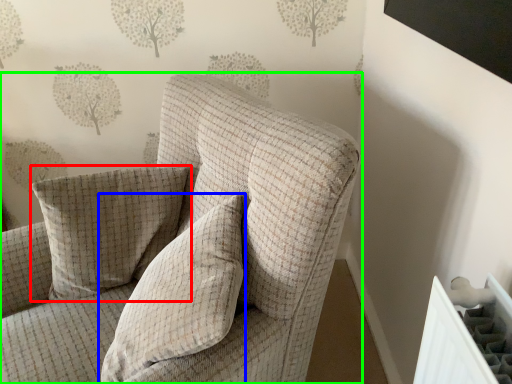
Question: Which object is positioned farthest from pillow (highlighted by a red box)? Select from pillow (highlighted by a blue box) and chair (highlighted by a green box).

Choices:
 (A) pillow
 (B) chair

Answer: (A)